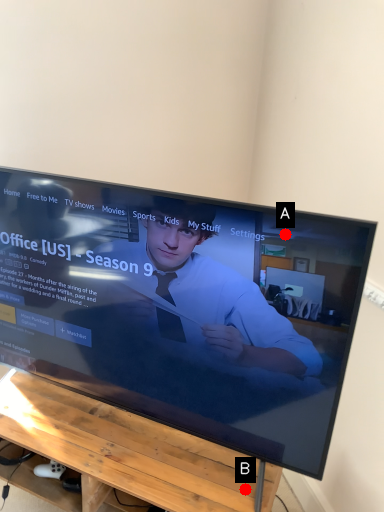
Question: Two points are circled on the image, labeled by A and B beside each circle. Among these points, which one is farthest from the camera?

Choices:
 (A) A is further
 (B) B is further

Answer: (B)